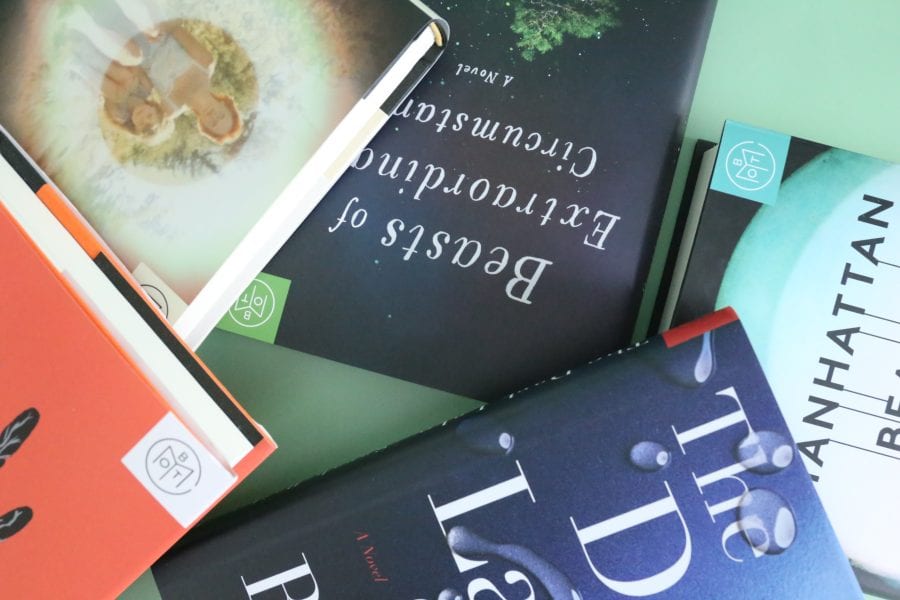
Identify the location of blue book. (597, 481).